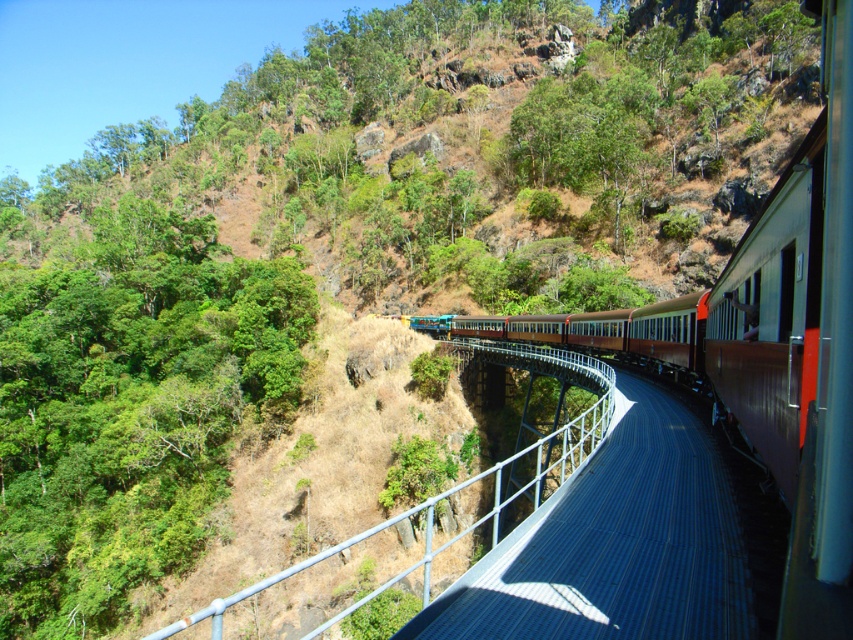
Question: Which point appears farthest from the camera in this image?

Choices:
 (A) (495, 340)
 (B) (805, 445)

Answer: (A)

Question: Can you confirm if brown metal train at center is positioned to the left of metallic blue rail at center?

Choices:
 (A) no
 (B) yes

Answer: (A)

Question: Which point appears closest to the camera in this image?

Choices:
 (A) (822, 342)
 (B) (339, 614)

Answer: (A)

Question: Is brown metal train at center positioned before metallic blue rail at center?

Choices:
 (A) no
 (B) yes

Answer: (B)

Question: Does brown metal train at center lie in front of metallic blue rail at center?

Choices:
 (A) yes
 (B) no

Answer: (A)

Question: Among these points, which one is nearest to the camera?

Choices:
 (A) (791, 509)
 (B) (540, 472)

Answer: (A)